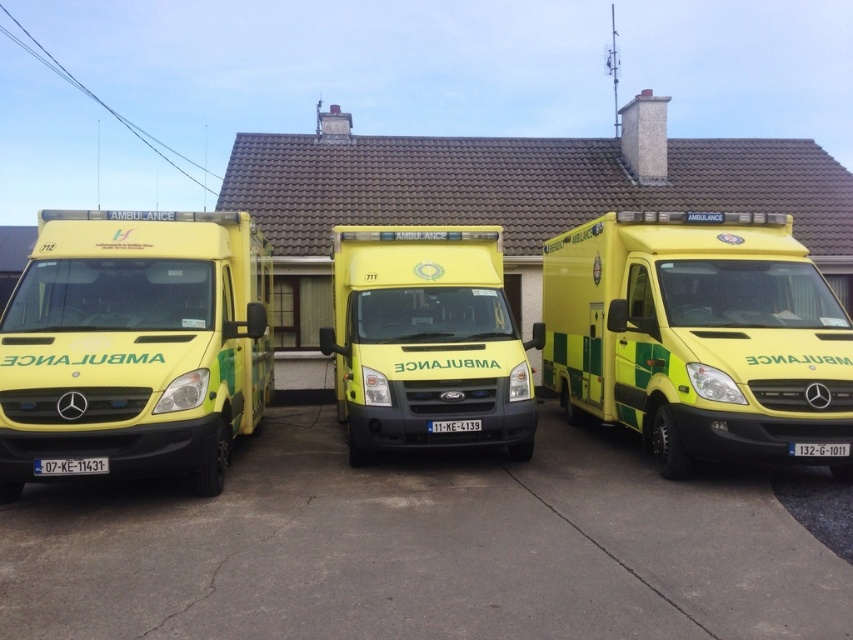
Between point (844, 337) and point (525, 413), which one is positioned in front?

Point (844, 337)

Where is `yellow/green striped ambulance at center`? yellow/green striped ambulance at center is located at coordinates pos(699,337).

This screenshot has width=853, height=640. What are the coordinates of `yellow/green striped ambulance at center` in the screenshot? It's located at (699, 337).

Which is above, yellow matte ambulance at left or yellow matte ambulance at center?

yellow matte ambulance at left is above.

Is yellow matte ambulance at left wider than yellow matte ambulance at center?

In fact, yellow matte ambulance at left might be narrower than yellow matte ambulance at center.

What do you see at coordinates (134, 346) in the screenshot? I see `yellow matte ambulance at left` at bounding box center [134, 346].

Identify the location of yellow matte ambulance at left. (134, 346).

Which is behind, point (624, 387) or point (207, 248)?

The point (624, 387) is behind.

Where is `yellow/green striped ambulance at center`? The image size is (853, 640). yellow/green striped ambulance at center is located at coordinates (699, 337).

Is point (659, 257) positioned after point (109, 256)?

Yes.

Where is `yellow/green striped ambulance at center`? The image size is (853, 640). yellow/green striped ambulance at center is located at coordinates (699, 337).